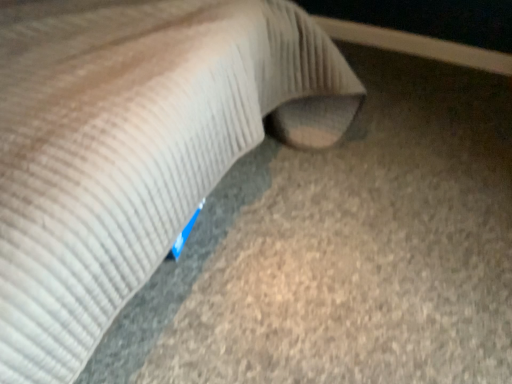
Locate an element on the screen. This screenshot has height=384, width=512. free spot below beige corduroy pillow at center (from a real-world perspective) is located at coordinates (227, 264).